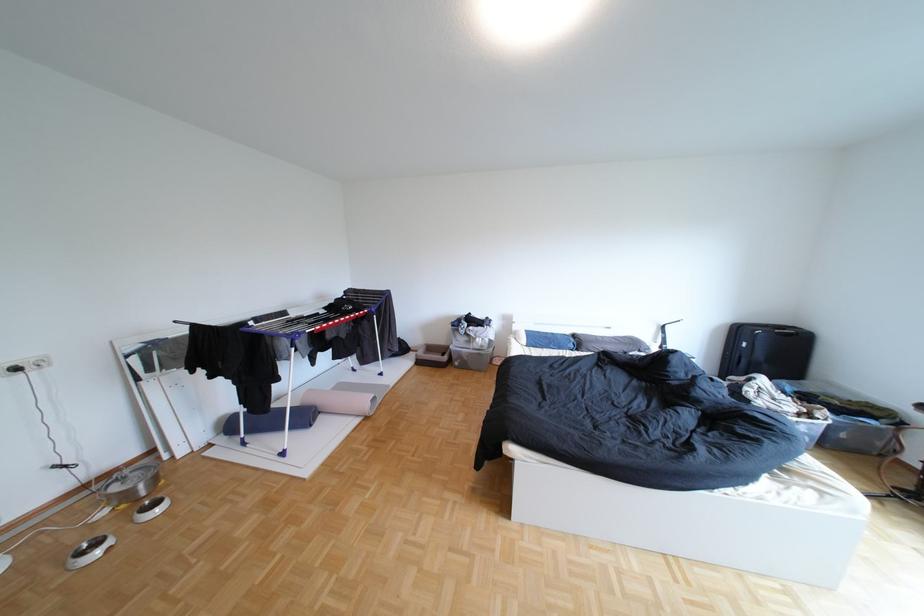
This screenshot has height=616, width=924. I want to click on clear storage bin, so click(x=470, y=357).